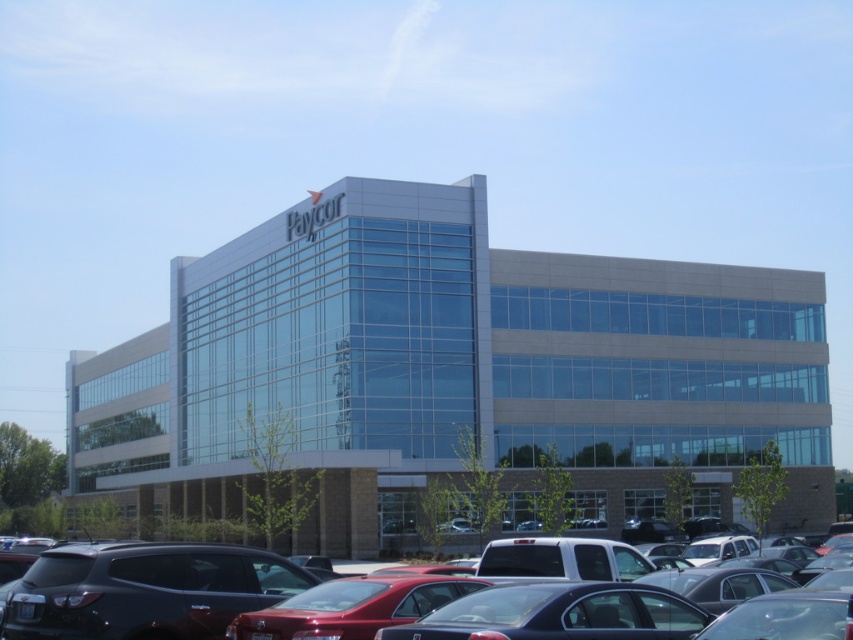
Does matte black sedan at center have a greater height compared to glossy black suv at lower left?

Yes.

Is matte black sedan at center below glossy black suv at lower left?

Yes.

This screenshot has width=853, height=640. What do you see at coordinates (204, 593) in the screenshot? I see `matte black sedan at center` at bounding box center [204, 593].

This screenshot has width=853, height=640. What are the coordinates of `matte black sedan at center` in the screenshot? It's located at (204, 593).